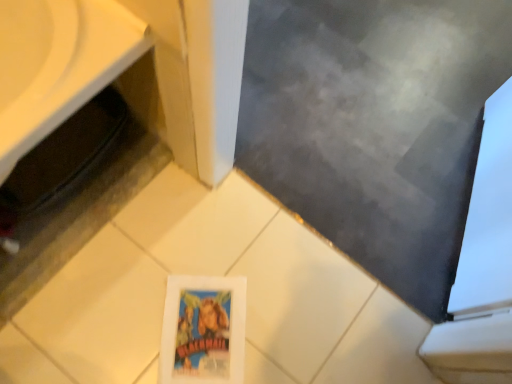
Question: Should I look upward or downward to see matte gray board at center?

Choices:
 (A) down
 (B) up

Answer: (B)